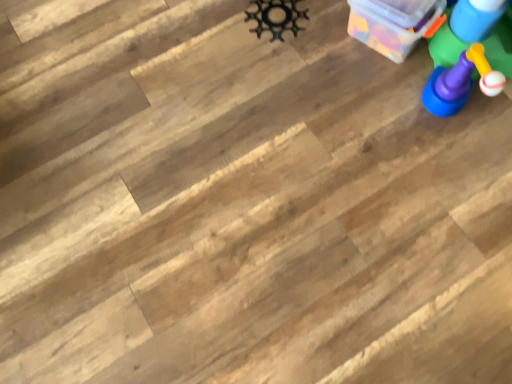
Where is `black metal gear at upper center, which is counted as the 1th toy, starting from the left`? black metal gear at upper center, which is counted as the 1th toy, starting from the left is located at coordinates click(x=276, y=17).

Identify the location of transparent plastic container at upper right. (392, 24).

This screenshot has width=512, height=384. Identify the location of matte plastic toy at right, placed as the second toy when sorted from left to right. (469, 54).

What's the angular difference between black metal gear at upper center, the third toy from the right, and blue plastic toy at upper right, the third toy when ordered from left to right,'s facing directions?

The angle between the facing direction of black metal gear at upper center, the third toy from the right, and the facing direction of blue plastic toy at upper right, the third toy when ordered from left to right, is 4.3 degrees.

Is black metal gear at upper center, the third toy from the right, wider than blue plastic toy at upper right, the third toy when ordered from left to right?

Correct, the width of black metal gear at upper center, the third toy from the right, exceeds that of blue plastic toy at upper right, the third toy when ordered from left to right.

Consider the image. In the image, is black metal gear at upper center, which is counted as the 1th toy, starting from the left, on the left side or the right side of blue plastic toy at upper right, marked as the first toy in a right-to-left arrangement?

Based on their positions, black metal gear at upper center, which is counted as the 1th toy, starting from the left, is located to the left of blue plastic toy at upper right, marked as the first toy in a right-to-left arrangement.

There is a blue plastic toy at upper right, marked as the first toy in a right-to-left arrangement. Identify the location of the 1st toy below it (from the image's perspective). (276, 17).

Which is more to the left, transparent plastic container at upper right or blue plastic toy at upper right, the third toy when ordered from left to right?

From the viewer's perspective, transparent plastic container at upper right appears more on the left side.

Is transparent plastic container at upper right looking in the opposite direction of blue plastic toy at upper right, marked as the first toy in a right-to-left arrangement?

transparent plastic container at upper right does not have its back to blue plastic toy at upper right, marked as the first toy in a right-to-left arrangement.

From a real-world perspective, is transparent plastic container at upper right positioned under blue plastic toy at upper right, the third toy when ordered from left to right, based on gravity?

No, from a real-world perspective, transparent plastic container at upper right is not under blue plastic toy at upper right, the third toy when ordered from left to right.

Consider the image. Is transparent plastic container at upper right bigger than blue plastic toy at upper right, the third toy when ordered from left to right?

Yes.

Is point (280, 9) positioned before point (466, 95)?

No, it is not.

From a real-world perspective, which toy is the 2nd one above the black metal gear at upper center, the third toy from the right? Please provide its 2D coordinates.

[(469, 54)]

Is black metal gear at upper center, the third toy from the right, oriented away from matte plastic toy at right, which is the 2th toy in right-to-left order?

black metal gear at upper center, the third toy from the right, is not turned away from matte plastic toy at right, which is the 2th toy in right-to-left order.

Which of these two, black metal gear at upper center, which is counted as the 1th toy, starting from the left, or matte plastic toy at right, which is the 2th toy in right-to-left order, stands taller?

matte plastic toy at right, which is the 2th toy in right-to-left order, is taller.

Between matte plastic toy at right, which is the 2th toy in right-to-left order, and blue plastic toy at upper right, marked as the first toy in a right-to-left arrangement, which one has larger width?

With larger width is matte plastic toy at right, which is the 2th toy in right-to-left order.

Can you tell me how much matte plastic toy at right, which is the 2th toy in right-to-left order, and blue plastic toy at upper right, marked as the first toy in a right-to-left arrangement, differ in facing direction?

The angle between the facing direction of matte plastic toy at right, which is the 2th toy in right-to-left order, and the facing direction of blue plastic toy at upper right, marked as the first toy in a right-to-left arrangement, is 49.1 degrees.

Is matte plastic toy at right, placed as the second toy when sorted from left to right, positioned in front of blue plastic toy at upper right, marked as the first toy in a right-to-left arrangement?

Yes.

From a real-world perspective, between matte plastic toy at right, placed as the second toy when sorted from left to right, and blue plastic toy at upper right, the third toy when ordered from left to right, who is vertically higher?

matte plastic toy at right, placed as the second toy when sorted from left to right, from a real-world perspective.

Is transparent plastic container at upper right at the right side of black metal gear at upper center, which is counted as the 1th toy, starting from the left?

Correct, you'll find transparent plastic container at upper right to the right of black metal gear at upper center, which is counted as the 1th toy, starting from the left.

Which of these two, transparent plastic container at upper right or black metal gear at upper center, which is counted as the 1th toy, starting from the left, is bigger?

transparent plastic container at upper right is bigger.

Which is in front, transparent plastic container at upper right or black metal gear at upper center, the third toy from the right?

transparent plastic container at upper right is in front.

Does transparent plastic container at upper right have a lesser width compared to matte plastic toy at right, placed as the second toy when sorted from left to right?

Yes, transparent plastic container at upper right is thinner than matte plastic toy at right, placed as the second toy when sorted from left to right.

Between transparent plastic container at upper right and matte plastic toy at right, placed as the second toy when sorted from left to right, which one appears on the left side from the viewer's perspective?

transparent plastic container at upper right.

Considering their positions, is transparent plastic container at upper right located in front of or behind matte plastic toy at right, which is the 2th toy in right-to-left order?

In the image, transparent plastic container at upper right appears behind matte plastic toy at right, which is the 2th toy in right-to-left order.

What's the angular difference between transparent plastic container at upper right and matte plastic toy at right, placed as the second toy when sorted from left to right,'s facing directions?

There is a 27.9-degree angle between the facing directions of transparent plastic container at upper right and matte plastic toy at right, placed as the second toy when sorted from left to right.

From the image's perspective, who appears lower, blue plastic toy at upper right, marked as the first toy in a right-to-left arrangement, or transparent plastic container at upper right?

transparent plastic container at upper right, from the image's perspective.

Which is in front, point (492, 10) or point (396, 22)?

The point (492, 10) is closer to the camera.

Who is shorter, blue plastic toy at upper right, marked as the first toy in a right-to-left arrangement, or transparent plastic container at upper right?

blue plastic toy at upper right, marked as the first toy in a right-to-left arrangement, is shorter.

How much distance is there between blue plastic toy at upper right, marked as the first toy in a right-to-left arrangement, and transparent plastic container at upper right?

blue plastic toy at upper right, marked as the first toy in a right-to-left arrangement, is 6.42 inches from transparent plastic container at upper right.

From the blue plastic toy at upper right, marked as the first toy in a right-to-left arrangement, count the 2nd toy to the left and point to it. Please provide its 2D coordinates.

[(276, 17)]

From the image's perspective, which toy is the 2nd one above the transparent plastic container at upper right? Please provide its 2D coordinates.

[(475, 18)]

Estimate the real-world distances between objects in this image. Which object is further from transparent plastic container at upper right, blue plastic toy at upper right, the third toy when ordered from left to right, or black metal gear at upper center, the third toy from the right?

Among the two, black metal gear at upper center, the third toy from the right, is located further to transparent plastic container at upper right.

Based on the photo, from the image, which object appears to be farther from matte plastic toy at right, placed as the second toy when sorted from left to right, transparent plastic container at upper right or blue plastic toy at upper right, the third toy when ordered from left to right?

Based on the image, transparent plastic container at upper right appears to be further to matte plastic toy at right, placed as the second toy when sorted from left to right.

Looking at the image, which one is located further to black metal gear at upper center, the third toy from the right, blue plastic toy at upper right, marked as the first toy in a right-to-left arrangement, or matte plastic toy at right, placed as the second toy when sorted from left to right?

Based on the image, blue plastic toy at upper right, marked as the first toy in a right-to-left arrangement, appears to be further to black metal gear at upper center, the third toy from the right.

Considering their positions, is black metal gear at upper center, which is counted as the 1th toy, starting from the left, positioned closer to matte plastic toy at right, placed as the second toy when sorted from left to right, than transparent plastic container at upper right?

Among the two, transparent plastic container at upper right is located nearer to matte plastic toy at right, placed as the second toy when sorted from left to right.

Looking at the image, which one is located closer to blue plastic toy at upper right, the third toy when ordered from left to right, matte plastic toy at right, placed as the second toy when sorted from left to right, or transparent plastic container at upper right?

The object closer to blue plastic toy at upper right, the third toy when ordered from left to right, is matte plastic toy at right, placed as the second toy when sorted from left to right.

When comparing their distances from matte plastic toy at right, which is the 2th toy in right-to-left order, does blue plastic toy at upper right, the third toy when ordered from left to right, or black metal gear at upper center, the third toy from the right, seem closer?

Based on the image, blue plastic toy at upper right, the third toy when ordered from left to right, appears to be nearer to matte plastic toy at right, which is the 2th toy in right-to-left order.

Based on their spatial positions, is black metal gear at upper center, the third toy from the right, or matte plastic toy at right, which is the 2th toy in right-to-left order, further from blue plastic toy at upper right, the third toy when ordered from left to right?

The object further to blue plastic toy at upper right, the third toy when ordered from left to right, is black metal gear at upper center, the third toy from the right.

Considering their positions, is blue plastic toy at upper right, the third toy when ordered from left to right, positioned closer to matte plastic toy at right, placed as the second toy when sorted from left to right, than transparent plastic container at upper right?

Among the two, blue plastic toy at upper right, the third toy when ordered from left to right, is located nearer to matte plastic toy at right, placed as the second toy when sorted from left to right.

Where is `toy located between transparent plastic container at upper right and blue plastic toy at upper right, marked as the first toy in a right-to-left arrangement, in the left-right direction`? This screenshot has width=512, height=384. toy located between transparent plastic container at upper right and blue plastic toy at upper right, marked as the first toy in a right-to-left arrangement, in the left-right direction is located at coordinates (469, 54).

What are the coordinates of `cardboard box between black metal gear at upper center, the third toy from the right, and matte plastic toy at right, which is the 2th toy in right-to-left order, from left to right` in the screenshot? It's located at (392, 24).

Where is `cardboard box situated between black metal gear at upper center, the third toy from the right, and blue plastic toy at upper right, marked as the first toy in a right-to-left arrangement, from left to right`? cardboard box situated between black metal gear at upper center, the third toy from the right, and blue plastic toy at upper right, marked as the first toy in a right-to-left arrangement, from left to right is located at coordinates (392, 24).

I want to click on toy between black metal gear at upper center, which is counted as the 1th toy, starting from the left, and blue plastic toy at upper right, the third toy when ordered from left to right, from left to right, so click(469, 54).